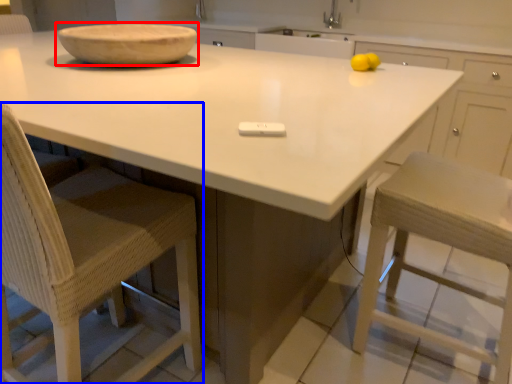
Question: Which of the following is the closest to the observer, bowl (highlighted by a red box) or chair (highlighted by a blue box)?

Choices:
 (A) bowl
 (B) chair

Answer: (B)